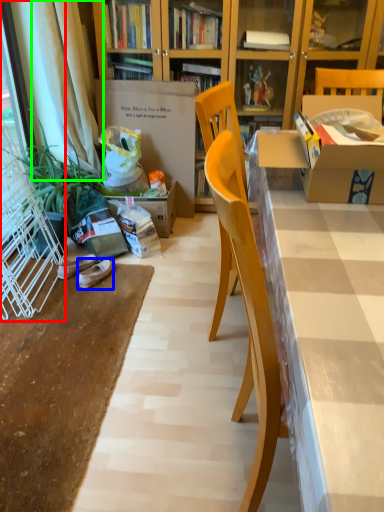
Question: Estimate the real-world distances between objects in this image. Which object is farther from screen door (highlighted by a red box), footwear (highlighted by a blue box) or curtain (highlighted by a green box)?

Choices:
 (A) footwear
 (B) curtain

Answer: (B)